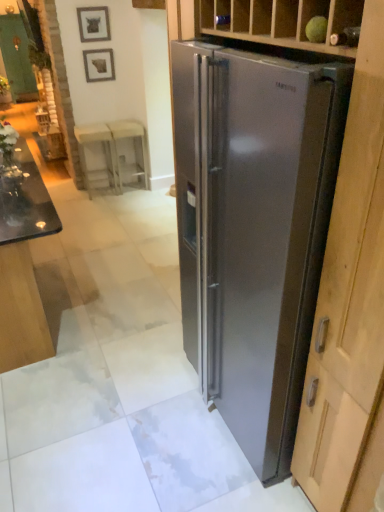
Question: From a real-world perspective, is green matte glass door at upper left above or below black glass table at lower left?

Choices:
 (A) below
 (B) above

Answer: (B)

Question: From their relative heights in the image, would you say green matte glass door at upper left is taller or shorter than black glass table at lower left?

Choices:
 (A) short
 (B) tall

Answer: (B)

Question: Based on their relative distances, which object is farther from the stainless steel refrigerator at right?

Choices:
 (A) metallic silver picture frame at upper center, which is the 1th picture frame from top to bottom
 (B) white plastic stool at center, which is counted as the first stool, starting from the right
 (C) matte gray picture frame at upper left, which is counted as the 2th picture frame, starting from the top
 (D) green matte glass door at upper left
 (E) black glass table at lower left

Answer: (D)

Question: Estimate the real-world distances between objects in this image. Which object is closer to the green matte glass door at upper left?

Choices:
 (A) black glass table at lower left
 (B) white plastic stool at center, the 1th stool when ordered from left to right
 (C) stainless steel refrigerator at right
 (D) matte gray picture frame at upper left, which appears as the first picture frame when ordered from the bottom
 (E) metallic silver picture frame at upper center, which is the 1th picture frame from top to bottom

Answer: (D)